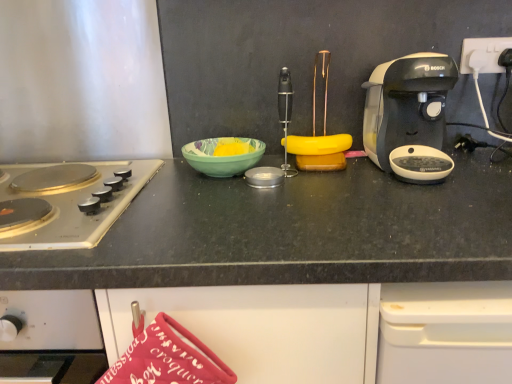
Where is `vacant space to the left of green glossy bowl at center`? Image resolution: width=512 pixels, height=384 pixels. vacant space to the left of green glossy bowl at center is located at coordinates (163, 169).